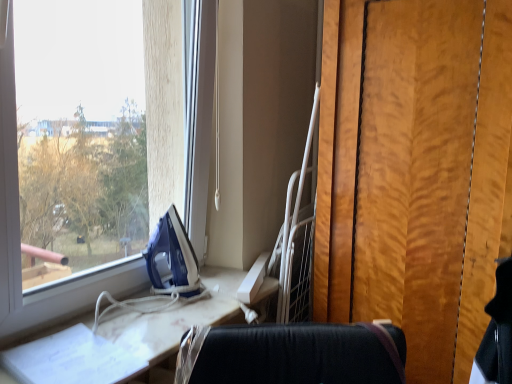
At what (x,y) coordinates should I click in order to perform the action: click on free space below blue plastic iron at window (from a real-world perspective). Please return your answer as a coordinate pair (x, y). This screenshot has width=512, height=384. Looking at the image, I should click on (181, 298).